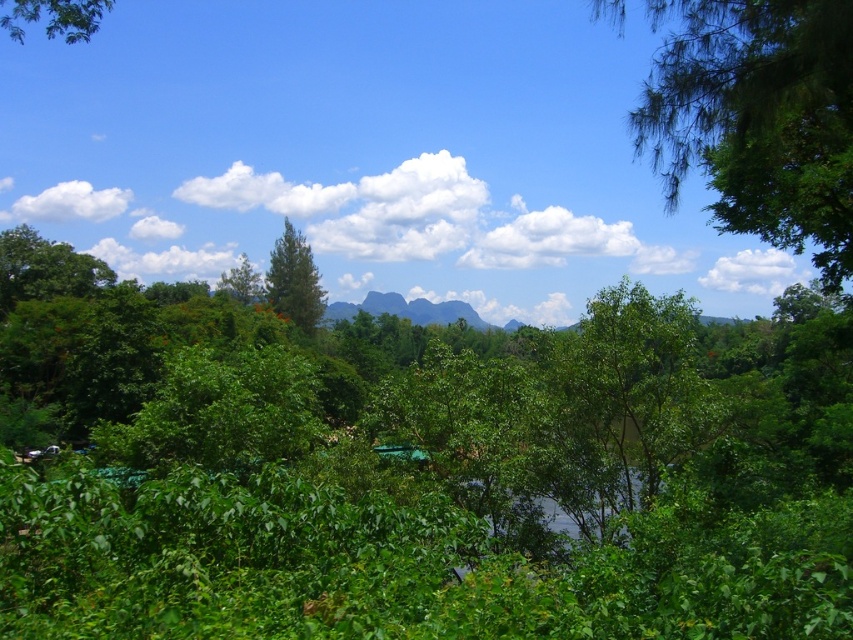
Question: Does green rock formation at center have a larger size compared to green leafy tree at center?

Choices:
 (A) no
 (B) yes

Answer: (B)

Question: Is green matte tree at center above green leafy tree at center?

Choices:
 (A) no
 (B) yes

Answer: (A)

Question: Where is green matte tree at center located in relation to green rock formation at center in the image?

Choices:
 (A) below
 (B) above

Answer: (A)

Question: Estimate the real-world distances between objects in this image. Which object is farther from the green matte tree at center?

Choices:
 (A) green leafy tree at upper left
 (B) green leafy tree at center

Answer: (A)

Question: Estimate the real-world distances between objects in this image. Which object is farther from the green leafy tree at center?

Choices:
 (A) green rock formation at center
 (B) green leafy tree at upper right
 (C) green leafy tree at upper left
 (D) green matte tree at center

Answer: (B)

Question: Considering the real-world distances, which object is farthest from the green leafy tree at center?

Choices:
 (A) green rock formation at center
 (B) green matte tree at center

Answer: (A)